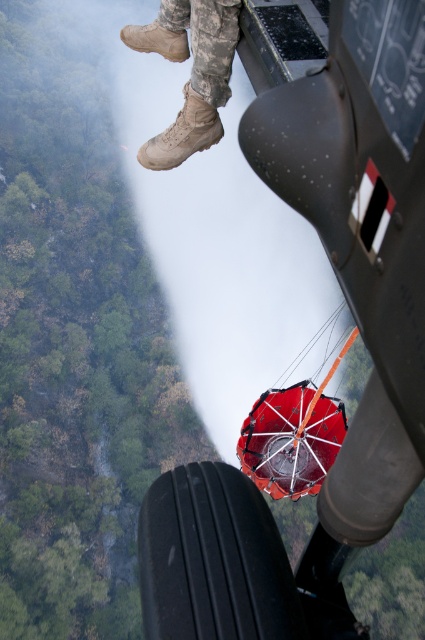
You are a pilot in the helicopter and need to check the distance between the matte black aircraft at center and the tan suede boots at upper center. Can you confirm if the distance is over 6 meters?

The matte black aircraft at center and the tan suede boots at upper center are 6.52 meters apart from each other, so yes, the distance is over 6 meters.

You are a passenger in the helicopter and want to look at the matte black aircraft at center and the tan suede boots at upper center. Which object is closer to the left side of your view?

The tan suede boots at upper center are closer to the left side of your view because the matte black aircraft at center is to the right of it.